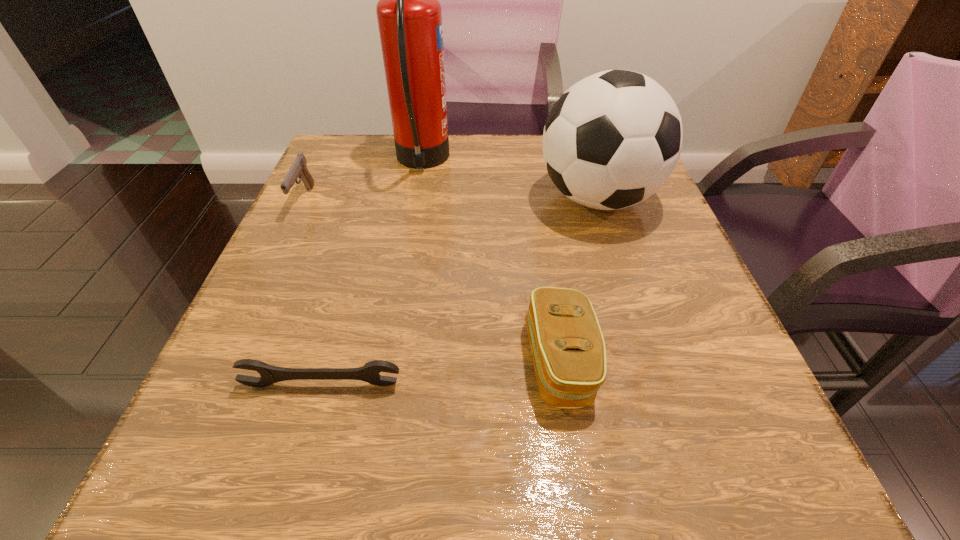
You are a GUI agent. You are given a task and a screenshot of the screen. Output one action in this format:
    pyautogui.click(x=<x>, y=<y>)
    Task: Click on the vacant area situated on the zipper side of the clutch bag
    The height and width of the screenshot is (540, 960).
    Given the screenshot: What is the action you would take?
    pyautogui.click(x=273, y=362)

The image size is (960, 540). Find the location of `vacant space situated 0.140m on the open ends of the wrench`. vacant space situated 0.140m on the open ends of the wrench is located at coordinates (291, 490).

This screenshot has height=540, width=960. In order to click on fire extinguisher situated at the far edge in this screenshot , I will do `click(409, 15)`.

Image resolution: width=960 pixels, height=540 pixels. I want to click on soccer ball that is at the far edge, so click(612, 139).

The image size is (960, 540). Find the location of `pistol that is positioned at the far edge`. pistol that is positioned at the far edge is located at coordinates (298, 169).

Identify the location of pistol that is positioned at the left edge. Image resolution: width=960 pixels, height=540 pixels. (298, 169).

The height and width of the screenshot is (540, 960). I want to click on wrench that is at the left edge, so [370, 371].

Locate an element on the screen. The width and height of the screenshot is (960, 540). object present at the right edge is located at coordinates (612, 139).

Where is `object at the far left corner`? This screenshot has height=540, width=960. object at the far left corner is located at coordinates (298, 169).

The width and height of the screenshot is (960, 540). In order to click on object that is at the far right corner in this screenshot , I will do `click(612, 139)`.